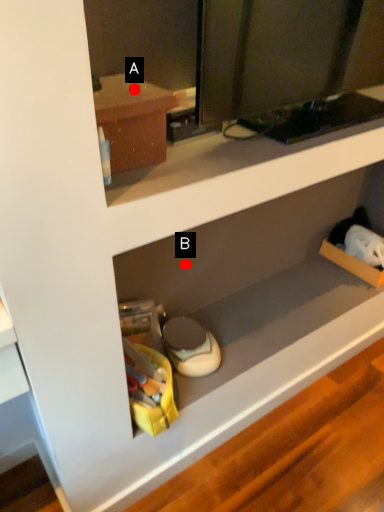
Question: Two points are circled on the image, labeled by A and B beside each circle. Among these points, which one is farthest from the camera?

Choices:
 (A) A is further
 (B) B is further

Answer: (B)